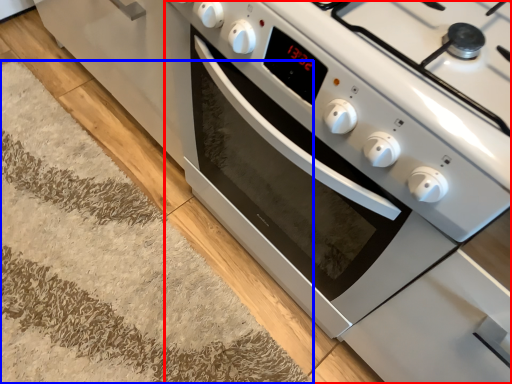
Question: Which object is further to the camera taking this photo, oven (highlighted by a red box) or doormat (highlighted by a blue box)?

Choices:
 (A) oven
 (B) doormat

Answer: (B)